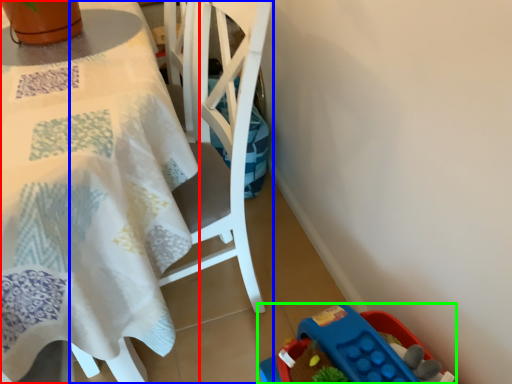
Question: Which is nearer to the table (highlighted by a red box)? chair (highlighted by a blue box) or toy (highlighted by a green box).

Choices:
 (A) chair
 (B) toy

Answer: (A)